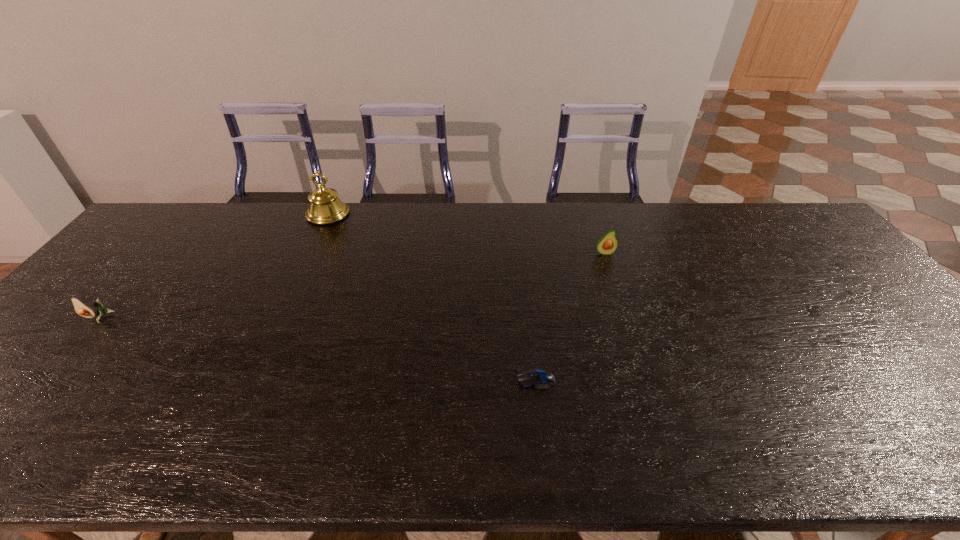
Locate an element on the screen. This screenshot has height=540, width=960. bell is located at coordinates (325, 207).

This screenshot has height=540, width=960. I want to click on the tallest object, so click(x=325, y=207).

Where is `the farther avocado`? This screenshot has width=960, height=540. the farther avocado is located at coordinates point(607,245).

Locate an element on the screen. The width and height of the screenshot is (960, 540). the second farthest object is located at coordinates (607, 245).

Identify the location of the leftmost object. (82, 307).

You are a GUI agent. You are given a task and a screenshot of the screen. Output one action in this format:
    pyautogui.click(x=<x>, y=<y>)
    Task: Click on the nearer avocado
    
    Given the screenshot: What is the action you would take?
    pyautogui.click(x=82, y=307)

You are a GUI agent. You are given a task and a screenshot of the screen. Output one action in this format:
    pyautogui.click(x=<x>, y=<y>)
    Task: Click on the computer mouse
    This screenshot has width=960, height=540.
    Given the screenshot: What is the action you would take?
    pyautogui.click(x=541, y=379)

The image size is (960, 540). I want to click on the second object from right to left, so click(541, 379).

This screenshot has height=540, width=960. In order to click on vacant position located on the right of the second object from left to right in this screenshot , I will do `click(435, 214)`.

Where is `free space located 0.080m on the cut side of the rightmost object`? This screenshot has height=540, width=960. free space located 0.080m on the cut side of the rightmost object is located at coordinates (612, 274).